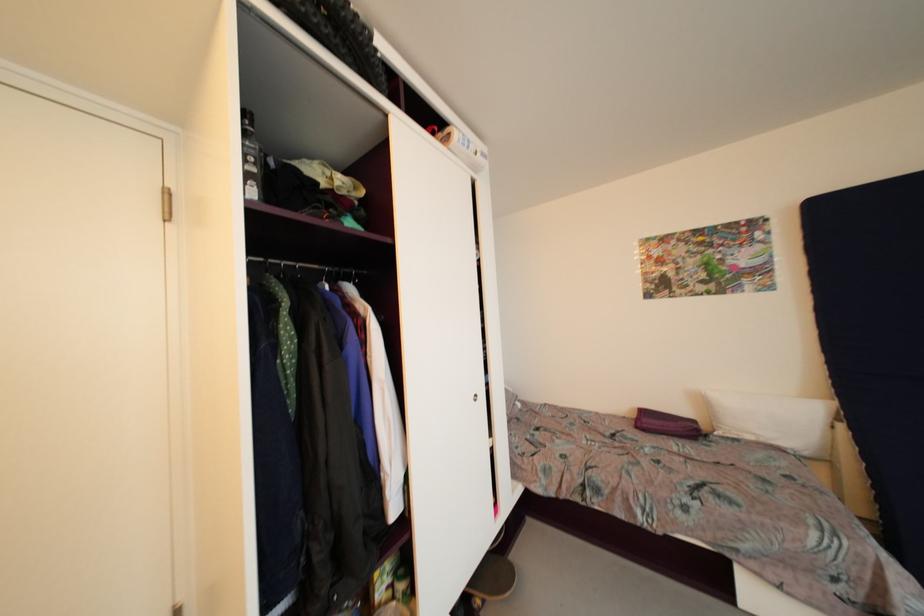
Where would you lift the skateboard deck? Please return your answer as a coordinate pair (x, y).

(490, 582)